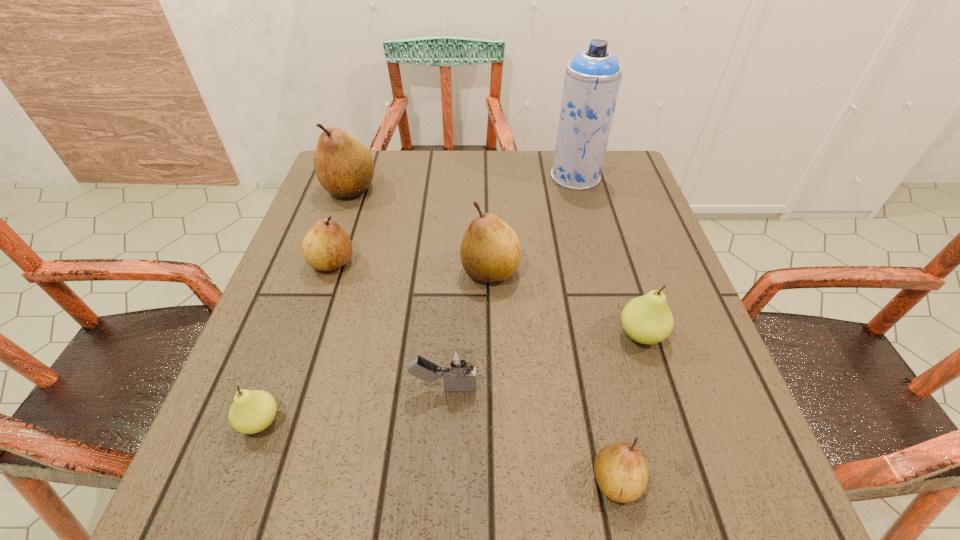
You are a GUI agent. You are given a task and a screenshot of the screen. Output one action in this format:
    pyautogui.click(x=<x>, y=<y>)
    Task: Click on the empty space between the rightmost brown pear and the gray igniter
    This screenshot has height=540, width=960.
    Given the screenshot: What is the action you would take?
    pyautogui.click(x=530, y=434)

I want to click on free space between the biggest brown pear and the smaller green pear, so click(305, 305).

Where is `free space between the second smallest brown pear and the farthest pear`? free space between the second smallest brown pear and the farthest pear is located at coordinates (341, 226).

Where is `free space between the fifth farthest object and the igniter`? This screenshot has height=540, width=960. free space between the fifth farthest object and the igniter is located at coordinates [542, 361].

Point out which object is positioned as the nearest to the second nearest pear. Please provide its 2D coordinates. Your answer should be formatted as a tuple, i.e. [(x, y)], where the tuple contains the x and y coordinates of a point satisfying the conditions above.

[(458, 366)]

Locate an element on the screen. object that is the fourth nearest to the second tallest pear is located at coordinates (593, 77).

Locate an element on the screen. This screenshot has height=540, width=960. the fourth closest pear relative to the fourth pear from left to right is located at coordinates (621, 472).

Select which pear is the closest to the third biggest brown pear. Please provide its 2D coordinates. Your answer should be formatted as a tuple, i.e. [(x, y)], where the tuple contains the x and y coordinates of a point satisfying the conditions above.

[(344, 167)]

The height and width of the screenshot is (540, 960). I want to click on brown pear identified as the third closest to the third tallest object, so click(x=621, y=472).

Select which brown pear is the second closest to the aerosol can. Please provide its 2D coordinates. Your answer should be formatted as a tuple, i.e. [(x, y)], where the tuple contains the x and y coordinates of a point satisfying the conditions above.

[(344, 167)]